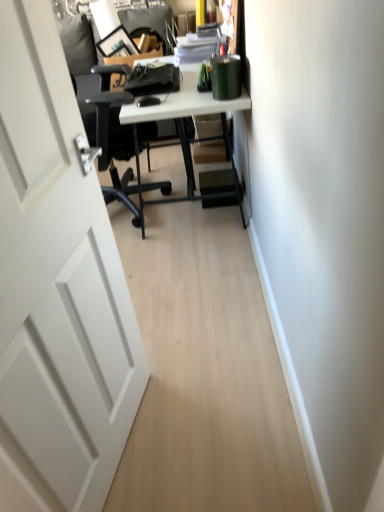
This screenshot has width=384, height=512. I want to click on vacant space behind white matte door at left, so click(176, 342).